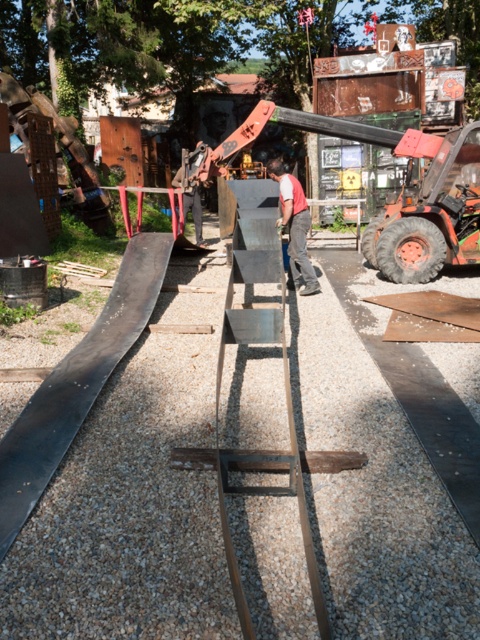
Question: Can you confirm if metallic gray ladder at center is positioned to the right of red cotton shirt at center?

Choices:
 (A) no
 (B) yes

Answer: (A)

Question: Is the position of metallic gray ladder at center less distant than that of rusty metal forklift at center?

Choices:
 (A) yes
 (B) no

Answer: (A)

Question: Which object is farther from the camera taking this photo?

Choices:
 (A) rusty metal forklift at center
 (B) red cotton shirt at center
 (C) metallic gray ladder at center

Answer: (A)

Question: Among these objects, which one is farthest from the camera?

Choices:
 (A) red cotton shirt at center
 (B) metallic gray ladder at center
 (C) rusty metal forklift at center

Answer: (C)

Question: Which point is farther from the camera taking this photo?

Choices:
 (A) click(x=432, y=253)
 (B) click(x=320, y=627)

Answer: (A)

Question: Is metallic gray ladder at center to the right of red cotton shirt at center from the viewer's perspective?

Choices:
 (A) yes
 (B) no

Answer: (B)